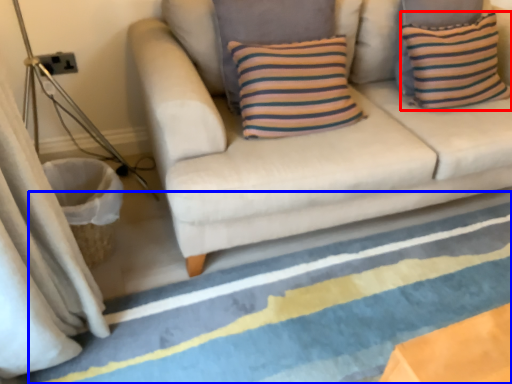
Question: Which object appears closest to the camera in this image, pillow (highlighted by a red box) or strip (highlighted by a blue box)?

Choices:
 (A) pillow
 (B) strip

Answer: (B)